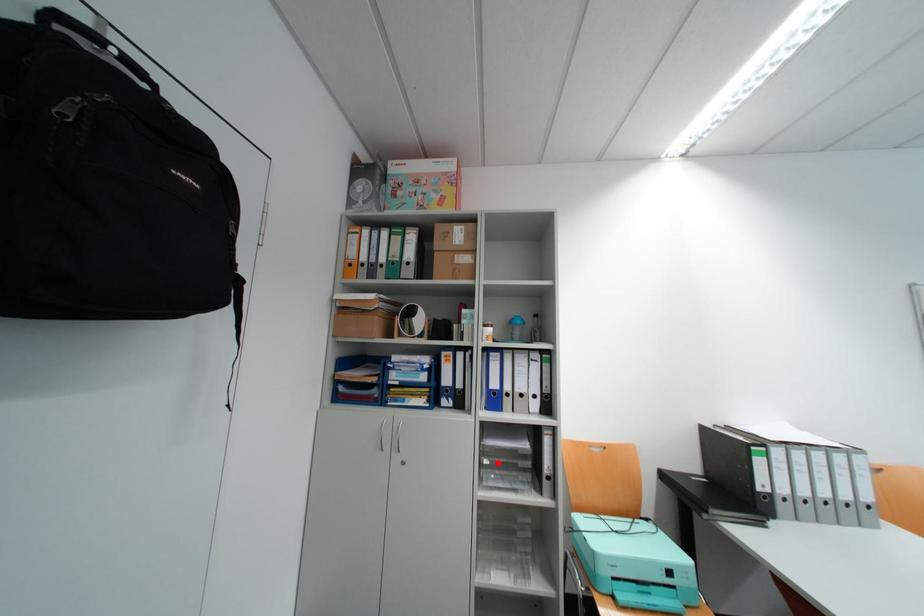
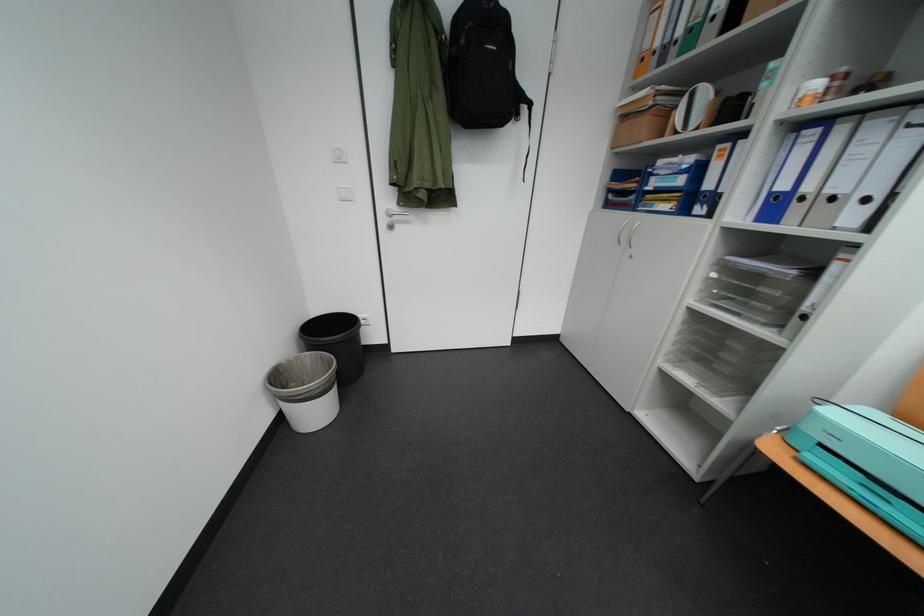
In the second image, find the point that corresponds to the highlighted location in the first image.

(724, 277)